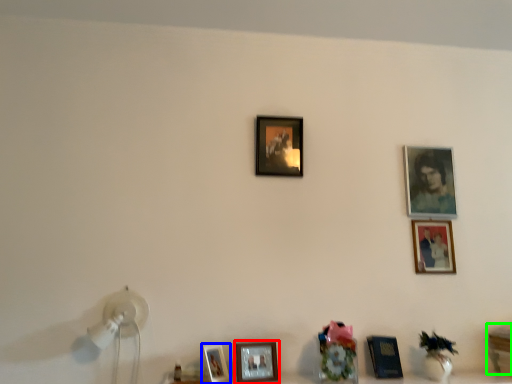
Question: Considering the real-world distances, which object is closest to picture frame (highlighted by a red box)? picture frame (highlighted by a blue box) or table (highlighted by a green box).

Choices:
 (A) picture frame
 (B) table

Answer: (A)